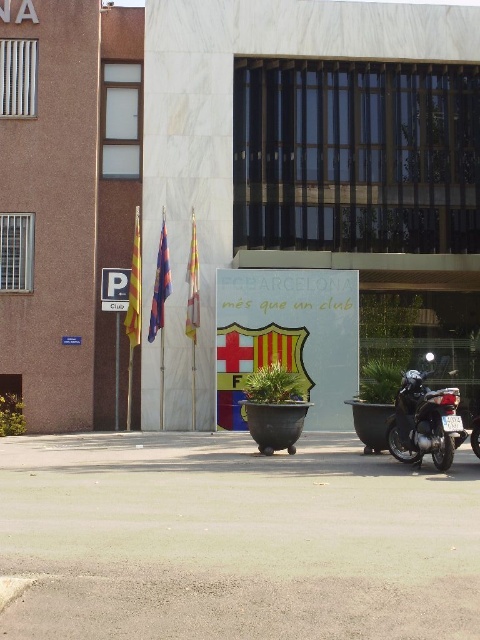
Question: Observing the image, what is the correct spatial positioning of polyester flag at left in reference to silky fabric flag at center?

Choices:
 (A) left
 (B) right

Answer: (A)

Question: Is yellow fabric flag at left to the right of polyester flag at left from the viewer's perspective?

Choices:
 (A) yes
 (B) no

Answer: (B)

Question: Is shiny black motorcycle at lower right smaller than silky fabric flag at center?

Choices:
 (A) yes
 (B) no

Answer: (B)

Question: Which object appears farthest from the camera in this image?

Choices:
 (A) silky fabric flag at center
 (B) yellow fabric flag at left
 (C) shiny black motorcycle at lower right
 (D) polyester flag at left

Answer: (D)

Question: Which of the following is the farthest from the observer?

Choices:
 (A) yellow fabric flag at left
 (B) polyester flag at left

Answer: (B)

Question: Which point is farther to the camera?

Choices:
 (A) (137, 230)
 (B) (169, 285)
 (C) (424, 404)

Answer: (B)